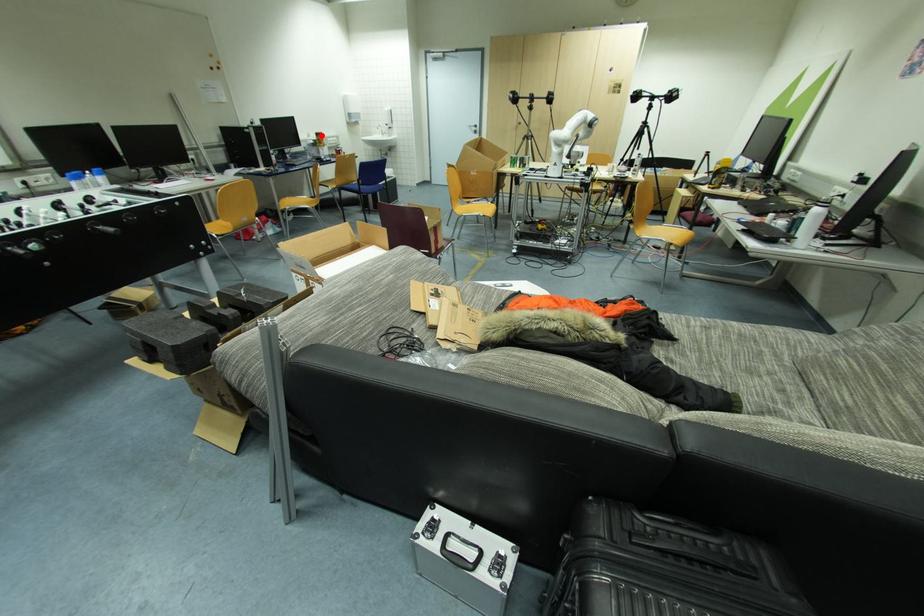
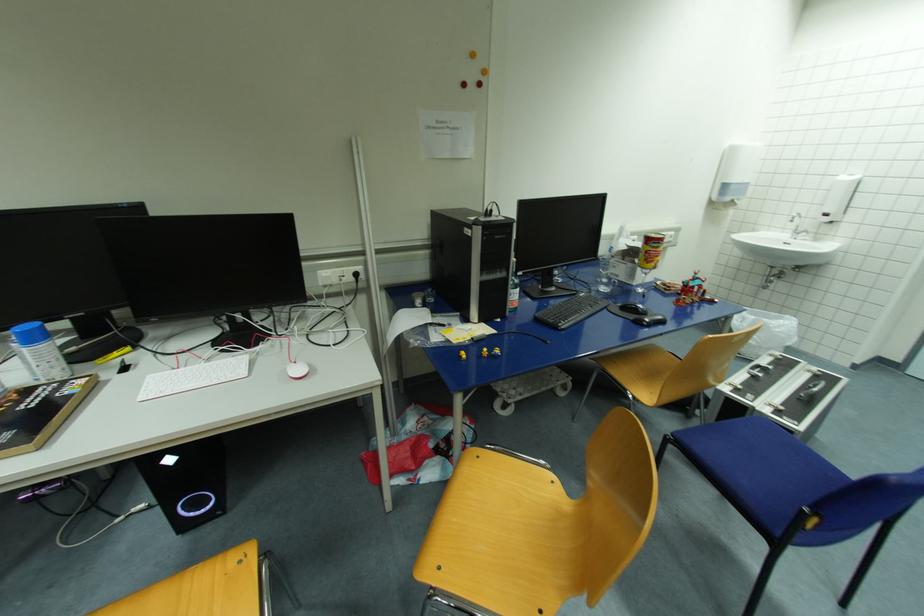
Question: A red point is marked in image1. In image2, is the corresponding 3D point closer to the camera or farther? Reply with the corresponding letter.

Choices:
 (A) The corresponding 3D point is closer.
 (B) The corresponding 3D point is farther.

Answer: (B)